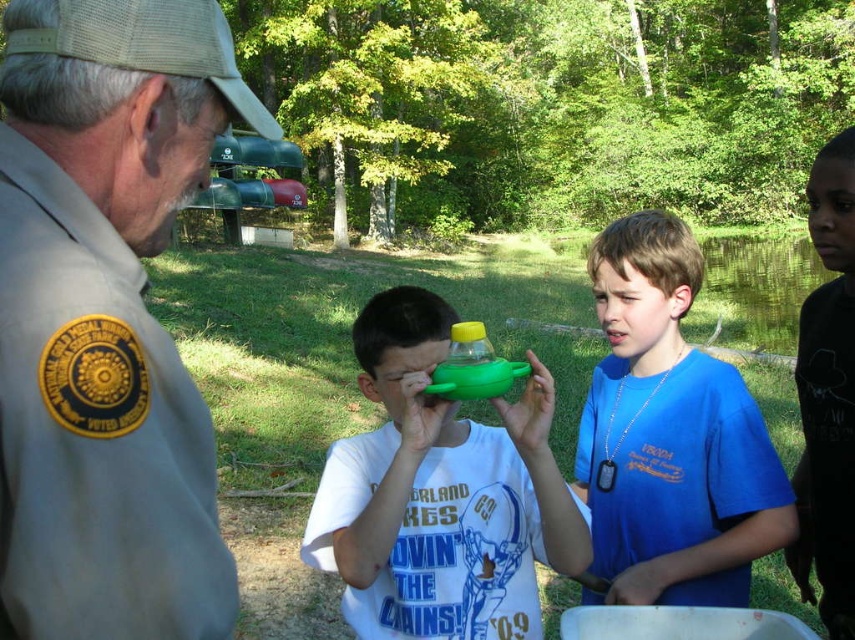
Which is more to the right, tan uniform at left or blue cotton shirt at center?

blue cotton shirt at center

Does tan uniform at left have a lesser width compared to blue cotton shirt at center?

Correct, tan uniform at left's width is less than blue cotton shirt at center's.

Is point (0, 301) behind point (600, 525)?

No, it is not.

Where is `tan uniform at left`? The image size is (855, 640). tan uniform at left is located at coordinates (105, 323).

Who is shorter, tan uniform at left or green matte toy at center?

With less height is tan uniform at left.

Which is more to the left, tan uniform at left or green matte toy at center?

From the viewer's perspective, tan uniform at left appears more on the left side.

Between point (59, 611) and point (323, 504), which one is positioned behind?

The point (323, 504) is more distant.

Where is `tan uniform at left`? tan uniform at left is located at coordinates (105, 323).

Does green matte toy at center have a smaller size compared to blue cotton shirt at center?

Incorrect, green matte toy at center is not smaller in size than blue cotton shirt at center.

Between point (392, 316) and point (673, 564), which one is positioned in front?

Point (392, 316) is in front.

Image resolution: width=855 pixels, height=640 pixels. What are the coordinates of `green matte toy at center` in the screenshot? It's located at (440, 493).

This screenshot has height=640, width=855. I want to click on green matte toy at center, so click(440, 493).